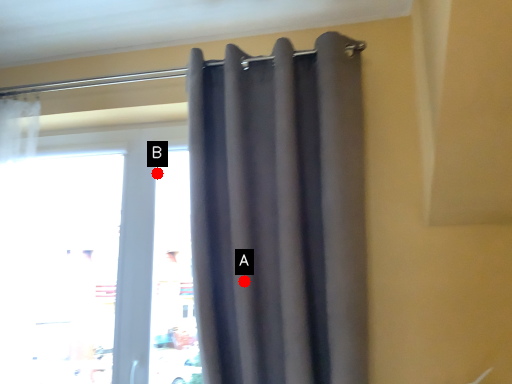
Question: Two points are circled on the image, labeled by A and B beside each circle. Which point is closer to the camera?

Choices:
 (A) A is closer
 (B) B is closer

Answer: (A)